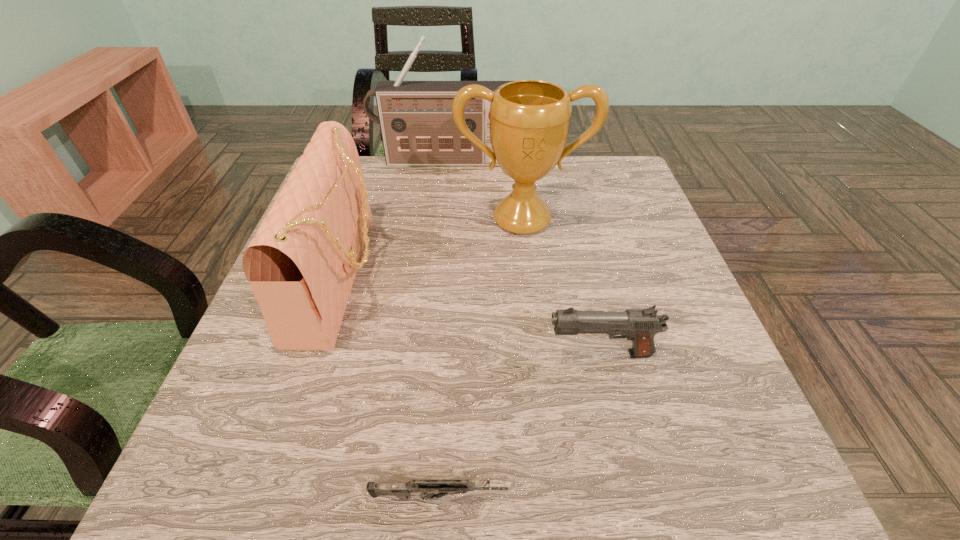
Locate an element on the screen. free space located 0.190m in the direction the taller gun is aimed is located at coordinates (438, 354).

At what (x,y) coordinates should I click in order to perform the action: click on vacant space located in the direction the taller gun is aimed. Please return your answer as a coordinate pair (x, y). This screenshot has width=960, height=540. Looking at the image, I should click on (334, 354).

Where is `free region located 0.170m in the direction the taller gun is aimed`? This screenshot has height=540, width=960. free region located 0.170m in the direction the taller gun is aimed is located at coordinates (449, 354).

The width and height of the screenshot is (960, 540). I want to click on vacant space located 0.280m aimed along the barrel of the nearest object, so click(x=713, y=497).

Locate an element on the screen. This screenshot has height=540, width=960. radio receiver located at the far edge is located at coordinates (417, 127).

Identify the location of award that is at the far edge. Image resolution: width=960 pixels, height=540 pixels. (529, 119).

Locate an element on the screen. This screenshot has height=540, width=960. object present at the near edge is located at coordinates (443, 487).

At what (x,y) coordinates should I click in order to perform the action: click on radio receiver present at the left edge. Please return your answer as a coordinate pair (x, y). The height and width of the screenshot is (540, 960). Looking at the image, I should click on (417, 127).

Locate an element on the screen. The height and width of the screenshot is (540, 960). handbag situated at the left edge is located at coordinates (301, 265).

The height and width of the screenshot is (540, 960). Identify the location of award present at the right edge. (529, 119).